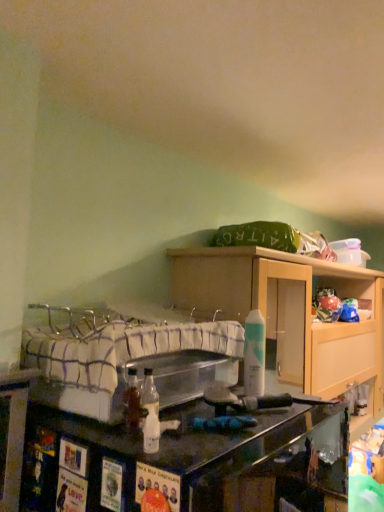
Question: Can you confirm if plaid fabric bed at center is wider than white matte spray can at center?

Choices:
 (A) yes
 (B) no

Answer: (A)

Question: From a real-world perspective, is plaid fabric bed at center under white matte spray can at center?

Choices:
 (A) no
 (B) yes

Answer: (B)

Question: Considering the relative positions of plaid fabric bed at center and white matte spray can at center in the image provided, is plaid fabric bed at center to the right of white matte spray can at center from the viewer's perspective?

Choices:
 (A) yes
 (B) no

Answer: (B)

Question: Considering the relative positions of plaid fabric bed at center and white matte spray can at center in the image provided, is plaid fabric bed at center to the left of white matte spray can at center from the viewer's perspective?

Choices:
 (A) no
 (B) yes

Answer: (B)

Question: Does plaid fabric bed at center have a greater height compared to white matte spray can at center?

Choices:
 (A) no
 (B) yes

Answer: (A)

Question: Looking at the image, does matte wood cabinet at upper center seem bigger or smaller compared to plaid fabric bed at center?

Choices:
 (A) small
 (B) big

Answer: (B)

Question: From a real-world perspective, is matte wood cabinet at upper center physically located above or below plaid fabric bed at center?

Choices:
 (A) below
 (B) above

Answer: (A)

Question: Considering the relative positions of matte wood cabinet at upper center and plaid fabric bed at center in the image provided, is matte wood cabinet at upper center to the left or to the right of plaid fabric bed at center?

Choices:
 (A) left
 (B) right

Answer: (B)

Question: From the image's perspective, is matte wood cabinet at upper center positioned above or below plaid fabric bed at center?

Choices:
 (A) above
 (B) below

Answer: (B)

Question: Based on their sizes in the image, would you say plaid fabric bed at center is bigger or smaller than white matte spray can at center?

Choices:
 (A) big
 (B) small

Answer: (A)

Question: In terms of height, does plaid fabric bed at center look taller or shorter compared to white matte spray can at center?

Choices:
 (A) short
 (B) tall

Answer: (A)

Question: From a real-world perspective, relative to white matte spray can at center, is plaid fabric bed at center vertically above or below?

Choices:
 (A) below
 (B) above

Answer: (A)

Question: In the image, is plaid fabric bed at center positioned in front of or behind white matte spray can at center?

Choices:
 (A) behind
 (B) front

Answer: (B)

Question: In the image, is matte wood cabinet at upper center on the left side or the right side of white matte spray can at center?

Choices:
 (A) right
 (B) left

Answer: (A)

Question: Is matte wood cabinet at upper center inside or outside of white matte spray can at center?

Choices:
 (A) inside
 (B) outside

Answer: (B)